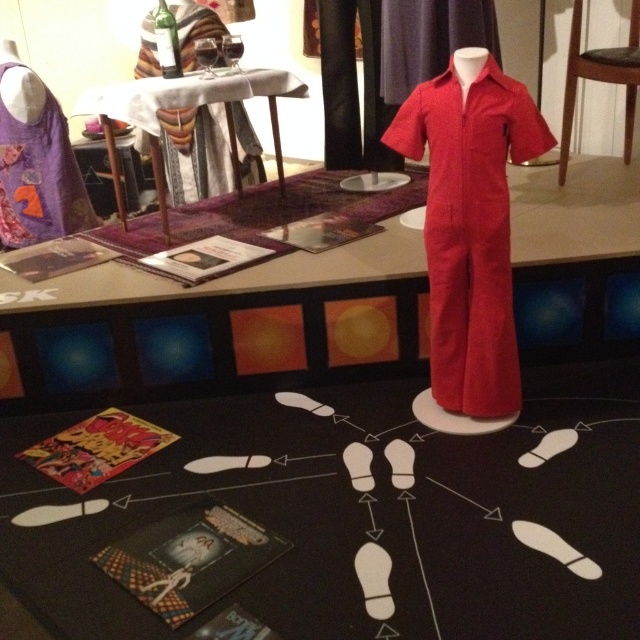
Does matte wood table at center have a greater width compared to wooden table at upper center?

Indeed, matte wood table at center has a greater width compared to wooden table at upper center.

Can you confirm if matte wood table at center is positioned below wooden table at upper center?

Yes, matte wood table at center is below wooden table at upper center.

Between point (628, 243) and point (228, 113), which one is positioned behind?

The point (228, 113) is behind.

The image size is (640, 640). I want to click on matte wood table at center, so click(x=218, y=324).

Does point (36, 124) come behind point (241, 115)?

No, it is not.

Can you confirm if purple cotton dress at upper left is positioned above matte red jumpsuit at upper center?

No, purple cotton dress at upper left is not above matte red jumpsuit at upper center.

Identify the location of purple cotton dress at upper left. Image resolution: width=640 pixels, height=640 pixels. (36, 168).

The image size is (640, 640). I want to click on purple cotton dress at upper left, so click(x=36, y=168).

Is matte wood table at center shorter than matte red jumpsuit at upper center?

Correct, matte wood table at center is not as tall as matte red jumpsuit at upper center.

You are a GUI agent. You are given a task and a screenshot of the screen. Output one action in this format:
    pyautogui.click(x=<x>, y=<y>)
    Task: Click on the matte wood table at center
    The height and width of the screenshot is (640, 640).
    Given the screenshot: What is the action you would take?
    pyautogui.click(x=218, y=324)

Who is more distant from viewer, (301,316) or (211,134)?

The point (211,134) is behind.

This screenshot has height=640, width=640. I want to click on matte wood table at center, so click(218, 324).